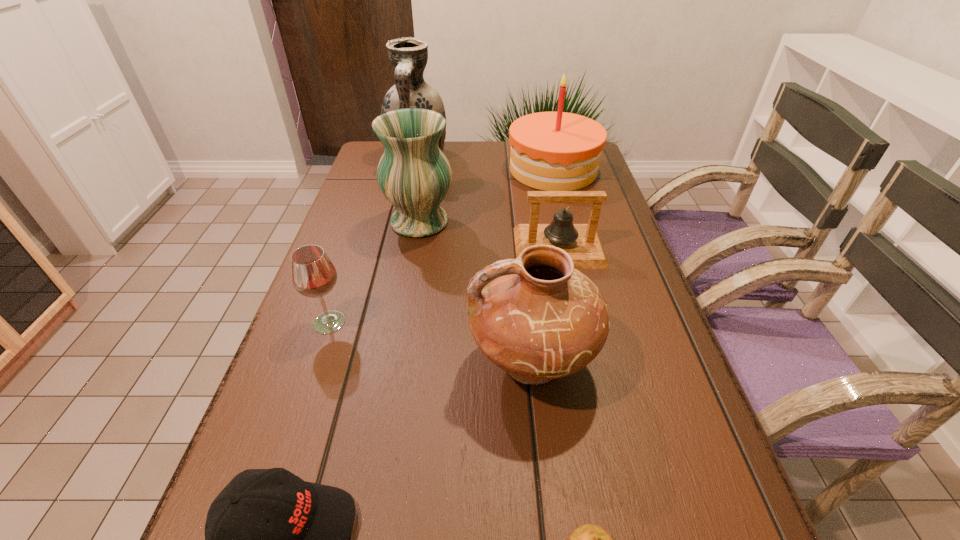
Where is `the tallest object`? The image size is (960, 540). the tallest object is located at coordinates (408, 56).

I want to click on the taller vase, so click(408, 56).

Locate an element on the screen. This screenshot has width=960, height=540. birthday cake is located at coordinates (551, 151).

Locate an element on the screen. the shorter vase is located at coordinates pyautogui.click(x=414, y=175).

Where is `pottery`? The height and width of the screenshot is (540, 960). pottery is located at coordinates (538, 318).

Where is `wineglass`? This screenshot has height=540, width=960. wineglass is located at coordinates (313, 275).

What are the coordinates of `the sixth tallest object` in the screenshot? It's located at (582, 242).

The height and width of the screenshot is (540, 960). Find the location of `vacant space located 0.380m with the handle on the side of the taller vase`. vacant space located 0.380m with the handle on the side of the taller vase is located at coordinates (396, 251).

This screenshot has width=960, height=540. I want to click on vacant space situated on the left of the birthday cake, so click(424, 170).

Identify the location of blank area located 0.280m on the front of the nearer vase. (401, 327).